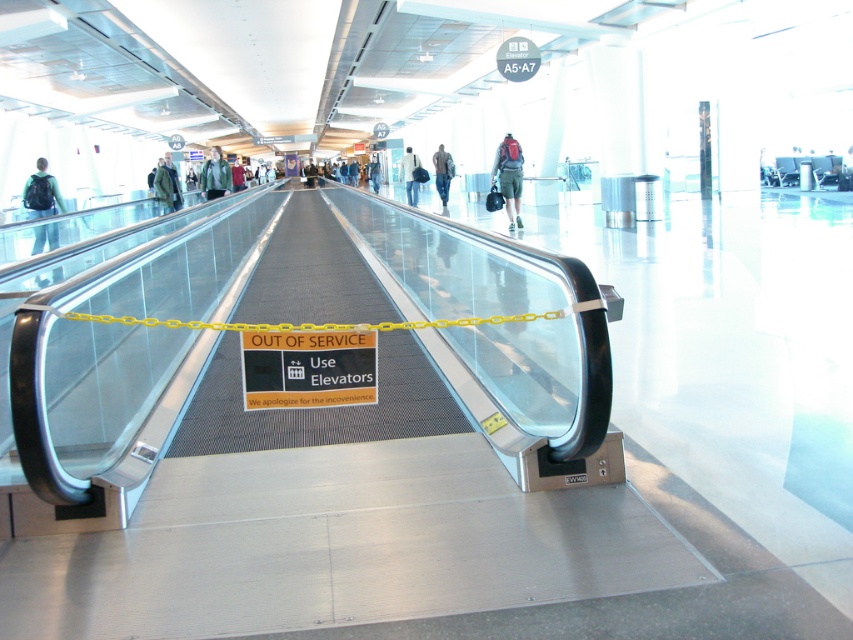
Is matte black backpack at left below denim pants at center?

Yes.

Does point (54, 227) lie in front of point (434, 179)?

Yes, point (54, 227) is closer to viewer.

At what (x,y) coordinates should I click in order to perform the action: click on matte black backpack at left. Please return your answer as a coordinate pair (x, y). The image size is (853, 640). Looking at the image, I should click on point(41,193).

Is green matte jacket at center to the left of green wool coat at center from the viewer's perspective?

No, green matte jacket at center is not to the left of green wool coat at center.

Who is positioned more to the left, green matte jacket at center or green wool coat at center?

Positioned to the left is green wool coat at center.

Who is more distant from viewer, (206, 160) or (173, 209)?

A: Positioned behind is point (206, 160).

Find the location of a particular element. The height and width of the screenshot is (640, 853). green matte jacket at center is located at coordinates (215, 173).

Between red backpack at center and green wool coat at center, which one is positioned lower?

Positioned lower is red backpack at center.

Who is taller, red backpack at center or green wool coat at center?

With more height is red backpack at center.

Identify the location of red backpack at center. The image size is (853, 640). (509, 177).

Image resolution: width=853 pixels, height=640 pixels. Identify the location of red backpack at center. (509, 177).